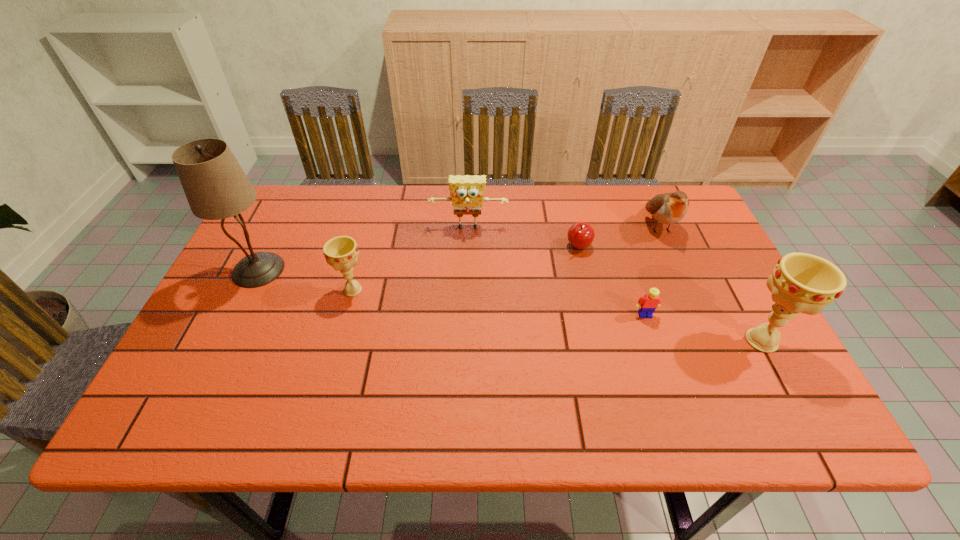
This screenshot has height=540, width=960. Find the location of `spot to insert another chalice for uniform distribution`. spot to insert another chalice for uniform distribution is located at coordinates (546, 314).